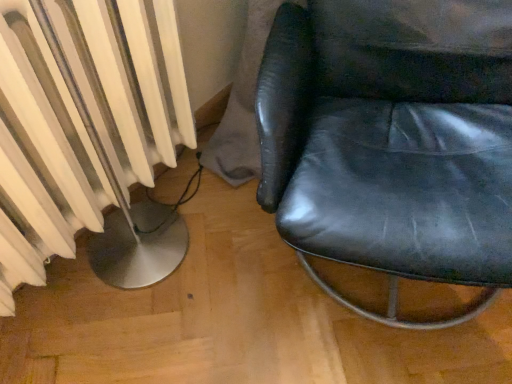
Question: Would you say white matte radiator at left is to the left or to the right of black leather chair at right in the picture?

Choices:
 (A) right
 (B) left

Answer: (B)

Question: Is white matte radiator at left taller or shorter than black leather chair at right?

Choices:
 (A) tall
 (B) short

Answer: (B)

Question: Considering the positions of white matte radiator at left and black leather chair at right in the image, is white matte radiator at left bigger or smaller than black leather chair at right?

Choices:
 (A) big
 (B) small

Answer: (B)

Question: From a real-world perspective, relative to white matte radiator at left, is black leather chair at right vertically above or below?

Choices:
 (A) below
 (B) above

Answer: (A)

Question: Is point (416, 92) positioned closer to the camera than point (155, 155)?

Choices:
 (A) closer
 (B) farther

Answer: (A)

Question: Would you say black leather chair at right is inside or outside white matte radiator at left?

Choices:
 (A) outside
 (B) inside

Answer: (A)

Question: From the image's perspective, relative to white matte radiator at left, is black leather chair at right above or below?

Choices:
 (A) below
 (B) above

Answer: (B)